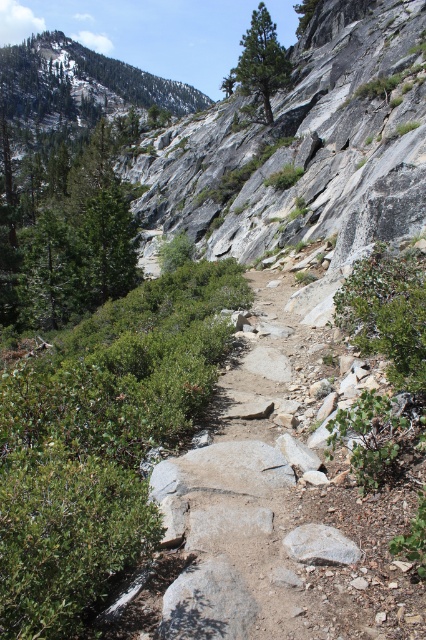
Is green leafy tree at left bigger than green textured pine tree at upper center?

Yes.

You are a GUI agent. You are given a task and a screenshot of the screen. Output one action in this format:
    pyautogui.click(x=<x>, y=<y>)
    Task: Click on the green leafy tree at left
    This screenshot has width=426, height=640.
    Given the screenshot: What is the action you would take?
    pyautogui.click(x=66, y=234)

The width and height of the screenshot is (426, 640). Find the location of `green leafy tree at left`. green leafy tree at left is located at coordinates (66, 234).

What do you see at coordinates (388, 314) in the screenshot? Image resolution: width=426 pixels, height=640 pixels. I see `green leafy shrub at upper right` at bounding box center [388, 314].

Is point (350, 298) positioned after point (322, 540)?

Yes, point (350, 298) is farther from viewer.

Find the location of a particular element. green leafy shrub at upper right is located at coordinates (388, 314).

Is green leafy shrub at upper right positioned behind green textured pine tree at upper center?

No, green leafy shrub at upper right is closer to the viewer.

Does green leafy shrub at upper right have a smaller size compared to green textured pine tree at upper center?

Yes, green leafy shrub at upper right is smaller than green textured pine tree at upper center.

This screenshot has height=640, width=426. I want to click on green leafy shrub at upper right, so click(x=388, y=314).